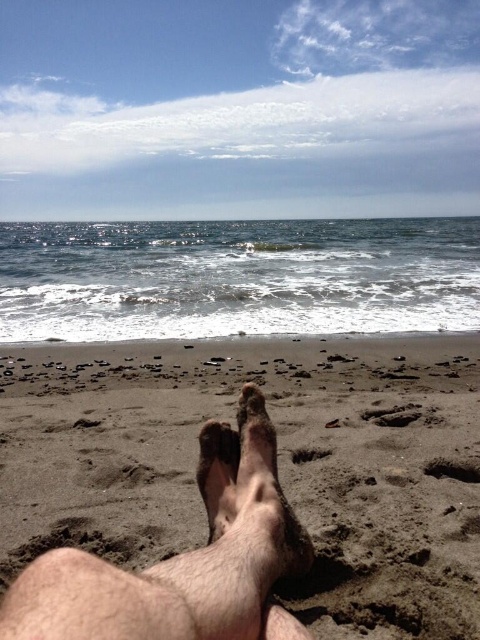
Is brown sandy feet at lower center above dry sand foot at center?

No, brown sandy feet at lower center is not above dry sand foot at center.

Between point (336, 605) and point (241, 492), which one is positioned behind?

The point (336, 605) is more distant.

Where is `brown sandy feet at lower center`? This screenshot has height=640, width=480. brown sandy feet at lower center is located at coordinates (278, 465).